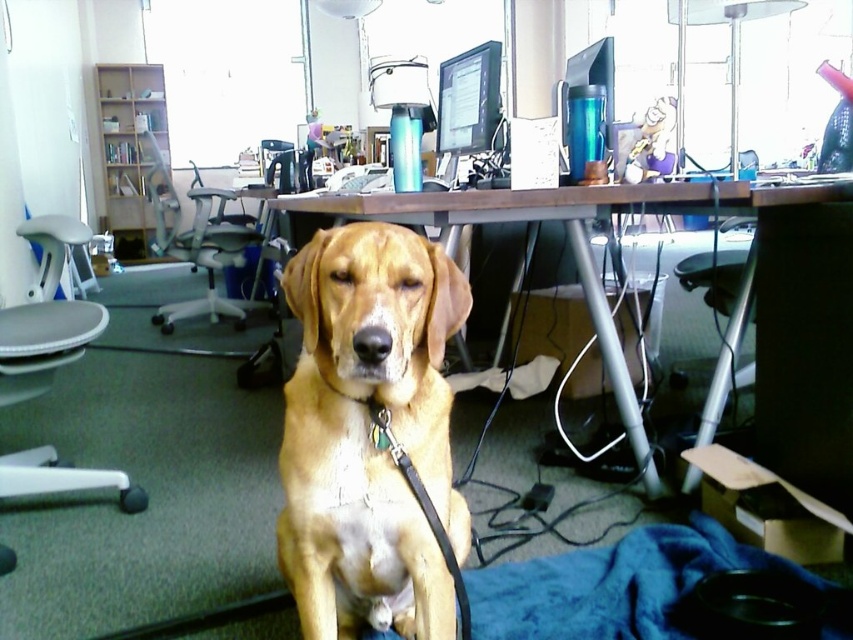
You are a delivery robot with a height of 1.6 meters. You need to deliver a package to the matte black monitor at upper center in the office. The golden fur dog at center is in your way. Can you go over the dog?

The distance between the golden fur dog at center and the matte black monitor at upper center is 1.51 meters. Since the robot is 1.6 meters tall, it can go over the dog as the robot is taller than the dog.

You are an office worker who wants to place a new plant pot on the desk. The plant pot is 10 cm tall. Considering the golden fur dog at center and the matte black monitor at upper center, which object is taller?

The golden fur dog at center is much taller than the matte black monitor at upper center, so the dog is taller than the plant pot.